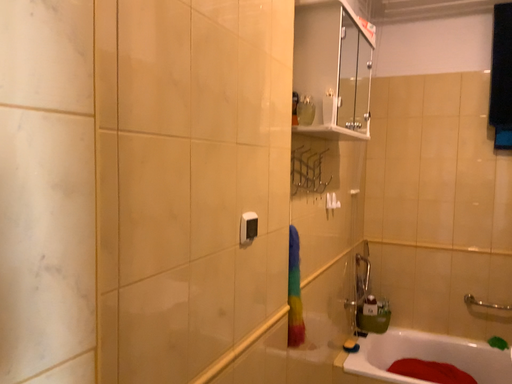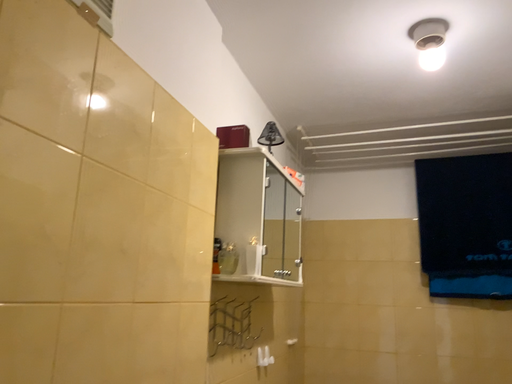
Question: Which way did the camera rotate in the video?

Choices:
 (A) rotated left
 (B) rotated right

Answer: (B)